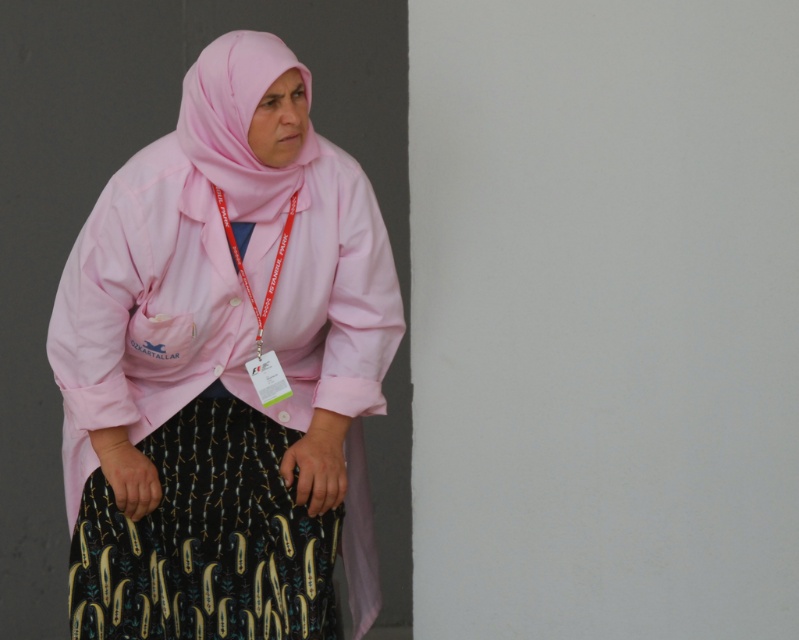
Question: Does pink fabric hijab at upper left have a larger size compared to pink fabric headscarf at upper center?

Choices:
 (A) yes
 (B) no

Answer: (A)

Question: Which point is closer to the camera?

Choices:
 (A) (177, 552)
 (B) (287, 173)

Answer: (B)

Question: Observing the image, what is the correct spatial positioning of pink fabric hijab at upper left in reference to pink fabric headscarf at upper center?

Choices:
 (A) below
 (B) above

Answer: (A)

Question: Among these points, which one is nearest to the camera?

Choices:
 (A) (205, 150)
 (B) (146, 598)

Answer: (A)

Question: Can you confirm if pink fabric hijab at upper left is positioned to the left of pink fabric headscarf at upper center?

Choices:
 (A) no
 (B) yes

Answer: (B)

Question: Which point is farther from the camera taking this photo?

Choices:
 (A) (185, 124)
 (B) (197, 180)

Answer: (B)